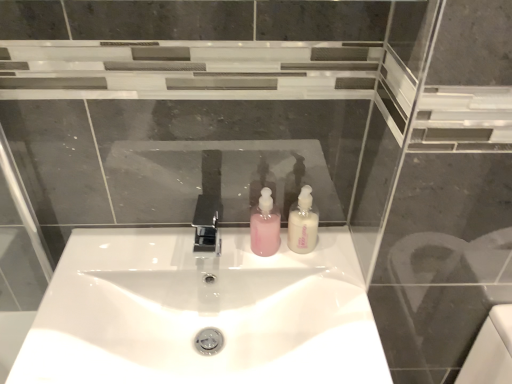
Locate an element on the screen. This screenshot has width=512, height=384. vacant area that is situated to the right of polished chrome tap at center is located at coordinates (273, 263).